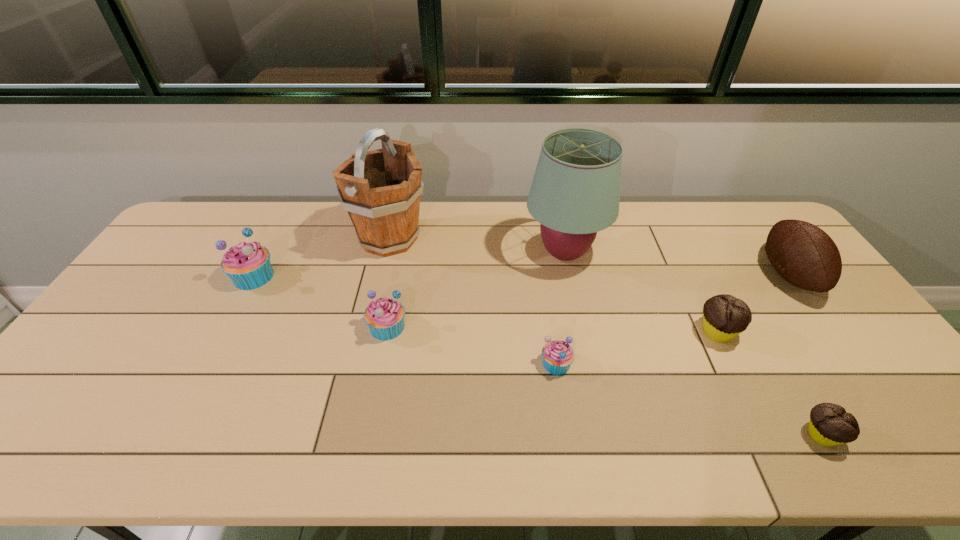
Find the location of a particular element. blue muffin that is the second closest one to the rightmost blue muffin is located at coordinates (248, 265).

Locate an element on the screen. This screenshot has height=540, width=960. free space in the image that satisfies the following two spatial constraints: 1. on the front side of the second muffin from left to right; 2. on the right side of the second muffin from right to left is located at coordinates (386, 332).

This screenshot has width=960, height=540. Identify the location of free space that satisfies the following two spatial constraints: 1. on the back side of the bucket; 2. on the right side of the farthest blue muffin. (274, 239).

Find the location of `free space that satisfies the following two spatial constraints: 1. on the laces of the brown football; 2. on the front side of the leftmost blue muffin`. free space that satisfies the following two spatial constraints: 1. on the laces of the brown football; 2. on the front side of the leftmost blue muffin is located at coordinates (790, 276).